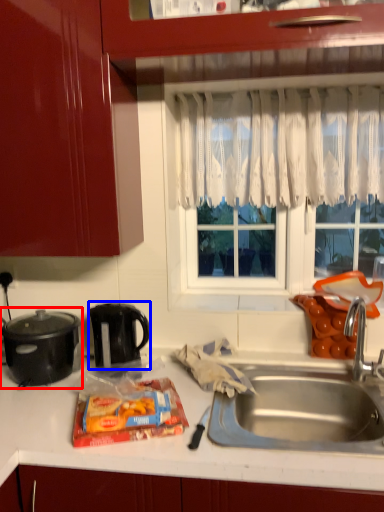
Question: Among these objects, which one is nearest to the camera, kitchen appliance (highlighted by a red box) or kitchen appliance (highlighted by a blue box)?

Choices:
 (A) kitchen appliance
 (B) kitchen appliance

Answer: (A)